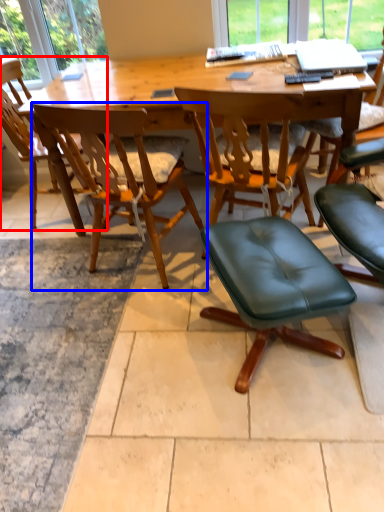
Question: Which object appears farthest to the camera in this image, chair (highlighted by a red box) or chair (highlighted by a blue box)?

Choices:
 (A) chair
 (B) chair

Answer: (A)